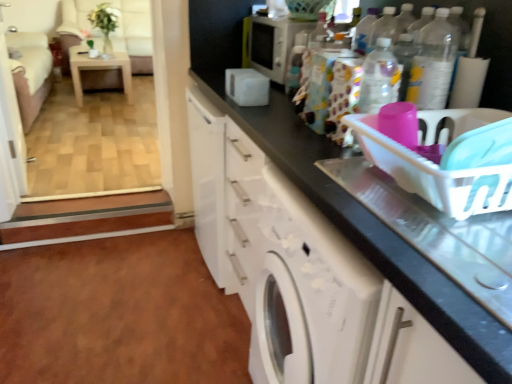
Find the location of a particular element. The image size is (512, 384). vacant location below white glossy screen door at upper left (from a real-world perspective) is located at coordinates (32, 172).